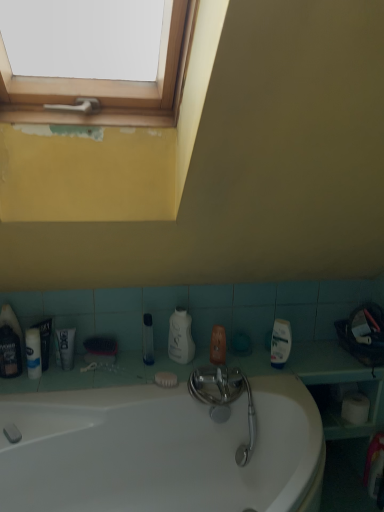
Question: Considering the relative sizes of clear plastic bottle at center, arranged as the 1th cleaning product when viewed from the left, and clear plastic tube at center, the 2th mouthwash in the front-to-back sequence, in the image provided, is clear plastic bottle at center, arranged as the 1th cleaning product when viewed from the left, smaller than clear plastic tube at center, the 2th mouthwash in the front-to-back sequence,?

Choices:
 (A) yes
 (B) no

Answer: (B)

Question: Is clear plastic bottle at center, which ranks as the second cleaning product in right-to-left order, in front of clear plastic tube at center, the 2th mouthwash in the front-to-back sequence?

Choices:
 (A) yes
 (B) no

Answer: (A)

Question: Is clear plastic bottle at center, arranged as the 1th cleaning product when viewed from the left, positioned with its back to clear plastic tube at center, which is the second mouthwash in left-to-right order?

Choices:
 (A) yes
 (B) no

Answer: (B)

Question: Is clear plastic bottle at center, arranged as the 1th cleaning product when viewed from the left, oriented towards clear plastic tube at center, the first mouthwash when ordered from right to left?

Choices:
 (A) yes
 (B) no

Answer: (B)

Question: From the image's perspective, is clear plastic bottle at center, arranged as the 1th cleaning product when viewed from the left, beneath clear plastic tube at center, the first mouthwash when ordered from right to left?

Choices:
 (A) yes
 (B) no

Answer: (B)

Question: Is clear plastic bottle at center, which ranks as the second cleaning product in right-to-left order, shorter than clear plastic tube at center, the first mouthwash when ordered from right to left?

Choices:
 (A) yes
 (B) no

Answer: (B)

Question: Considering the relative positions of white matte soap at lower center and white matte tube at lower left in the image provided, is white matte soap at lower center to the right of white matte tube at lower left from the viewer's perspective?

Choices:
 (A) no
 (B) yes

Answer: (B)

Question: Is white matte soap at lower center far away from white matte tube at lower left?

Choices:
 (A) yes
 (B) no

Answer: (B)

Question: Does white matte soap at lower center have a lesser height compared to white matte tube at lower left?

Choices:
 (A) no
 (B) yes

Answer: (B)

Question: Considering the relative positions of white matte soap at lower center and white matte tube at lower left in the image provided, is white matte soap at lower center in front of white matte tube at lower left?

Choices:
 (A) no
 (B) yes

Answer: (A)

Question: From a real-world perspective, is white matte soap at lower center on top of white matte tube at lower left?

Choices:
 (A) yes
 (B) no

Answer: (B)

Question: From the image's perspective, is white matte soap at lower center located above white matte tube at lower left?

Choices:
 (A) no
 (B) yes

Answer: (A)

Question: Does white glossy bathtub at center come in front of white matte tube at lower left?

Choices:
 (A) no
 (B) yes

Answer: (B)